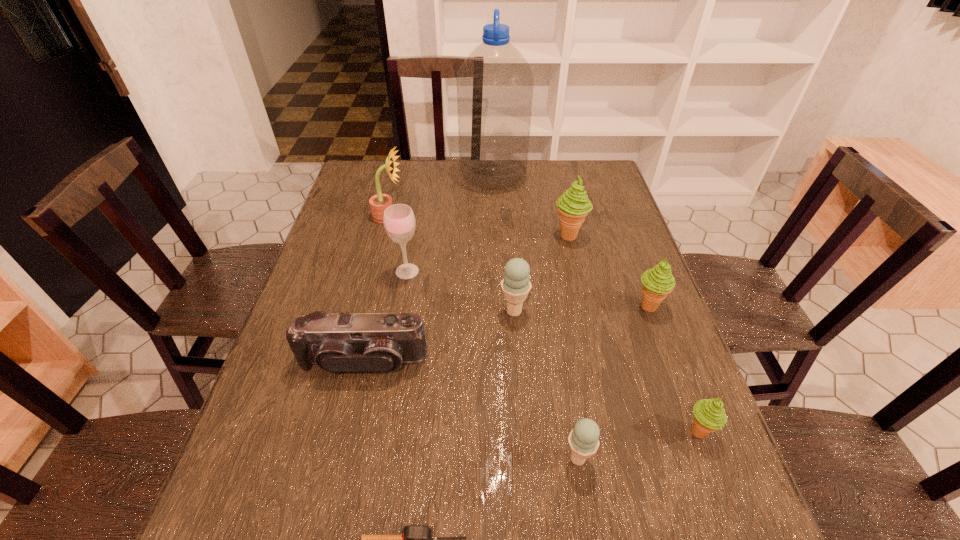
The height and width of the screenshot is (540, 960). Identify the location of free region that satisfies the following two spatial constraints: 1. on the face of the sunflower; 2. on the right side of the farthest green icecream. (384, 236).